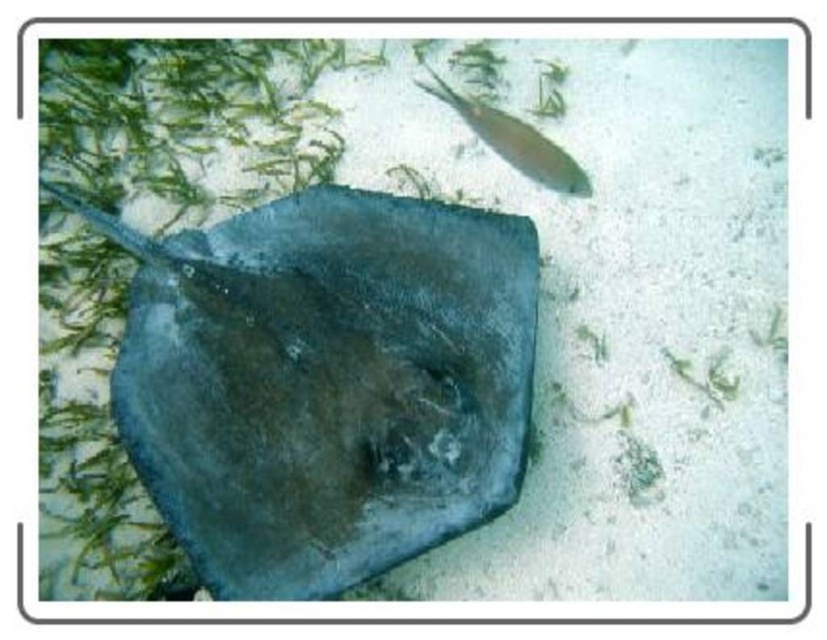
Which of these two, dark blue leather stingray at center or shiny silver fish at upper right, stands shorter?

shiny silver fish at upper right

Can you confirm if dark blue leather stingray at center is thinner than shiny silver fish at upper right?

Incorrect, dark blue leather stingray at center's width is not less than shiny silver fish at upper right's.

Image resolution: width=827 pixels, height=640 pixels. What are the coordinates of `dark blue leather stingray at center` in the screenshot? It's located at (326, 381).